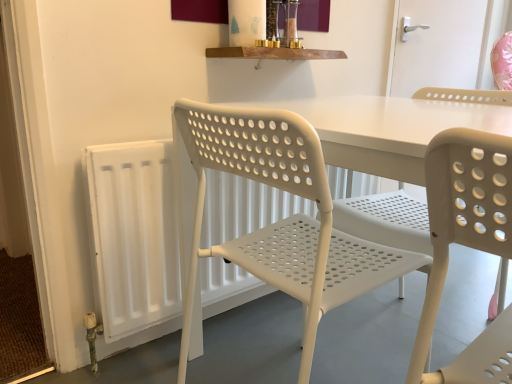
Question: Relative to white plastic chair at left, is white plastic door handle at upper right in front or behind?

Choices:
 (A) behind
 (B) front

Answer: (A)

Question: From the image's perspective, is white plastic door handle at upper right positioned above or below white plastic chair at left?

Choices:
 (A) below
 (B) above

Answer: (B)

Question: Which of these objects is positioned closest to the white plastic door handle at upper right?

Choices:
 (A) white plastic chair at left
 (B) white plastic radiator at left

Answer: (B)

Question: Estimate the real-world distances between objects in this image. Which object is closer to the white plastic radiator at left?

Choices:
 (A) white plastic door handle at upper right
 (B) white plastic chair at left

Answer: (B)